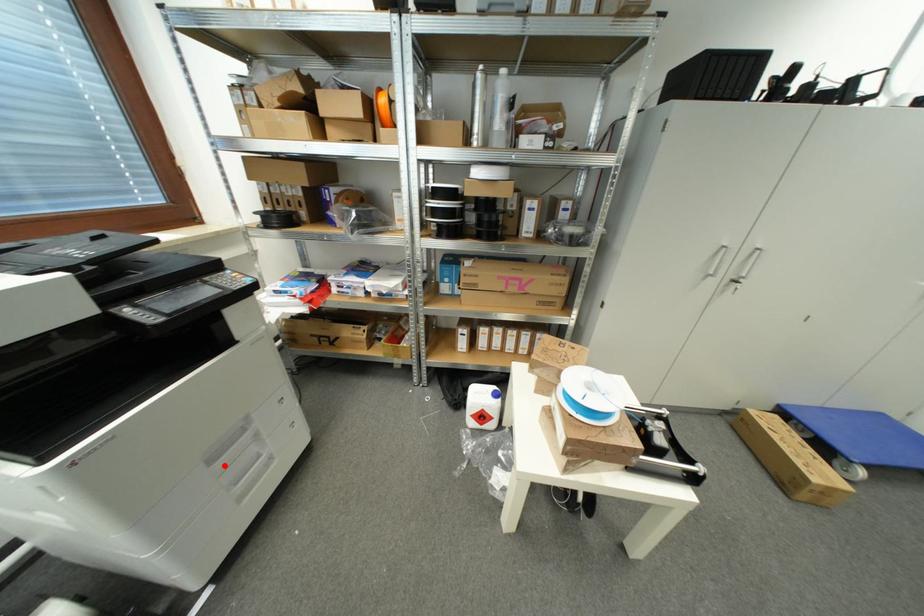
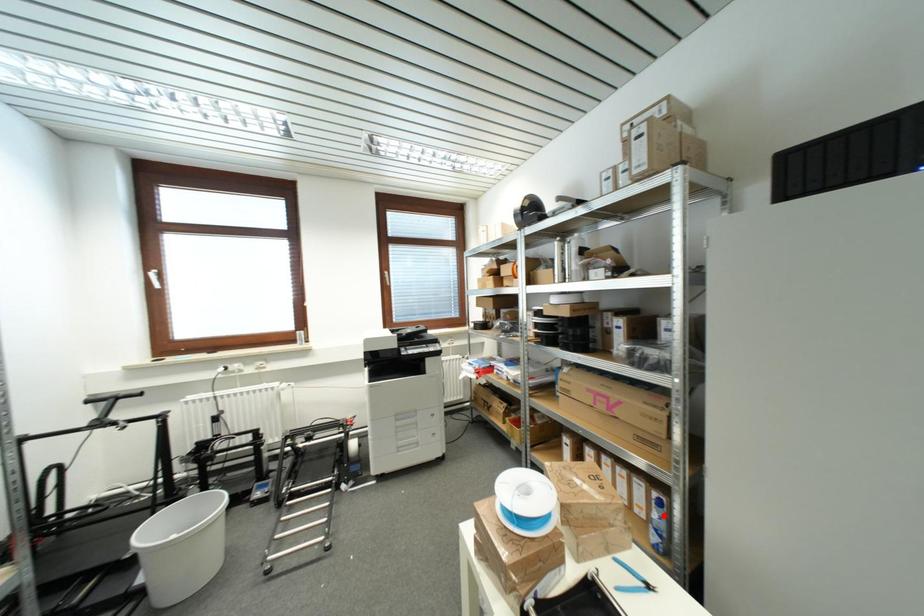
I am providing you with two images of the same scene from different viewpoints. A red point is marked on the first image and another point is marked on the second image. Does the point marked in image1 correspond to the same location as the one in image2?

No